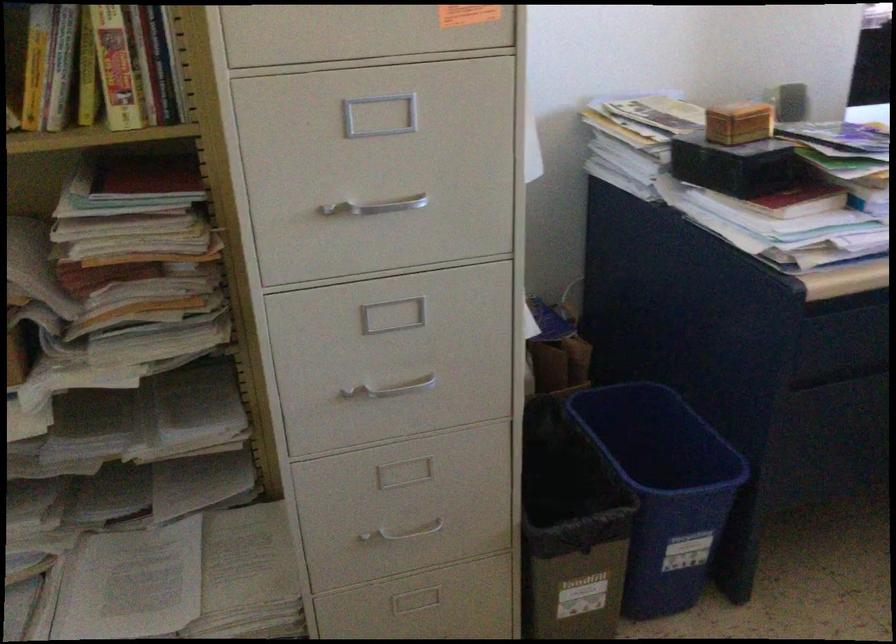
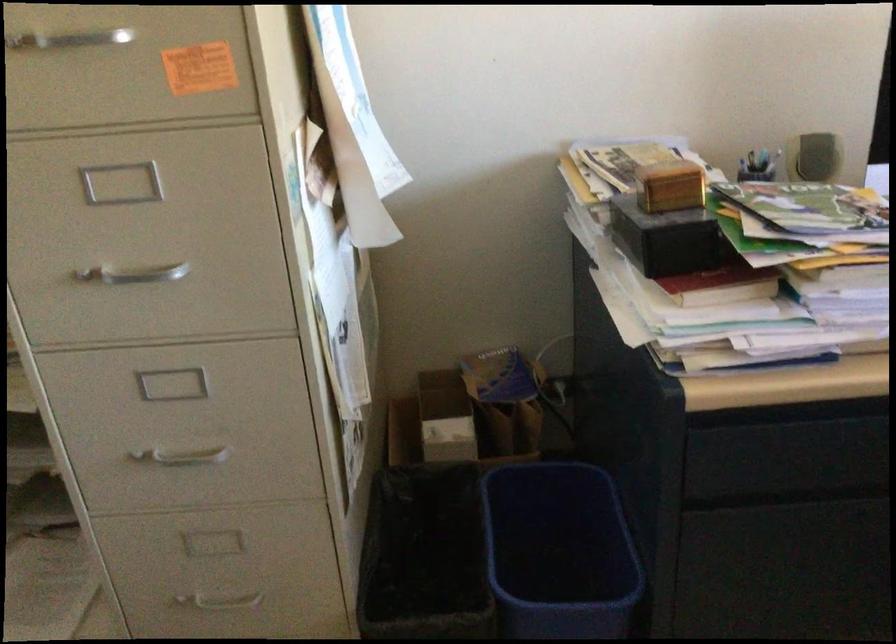
Where in the second image is the point corresponding to the point at 385,389 from the first image?

(181, 456)